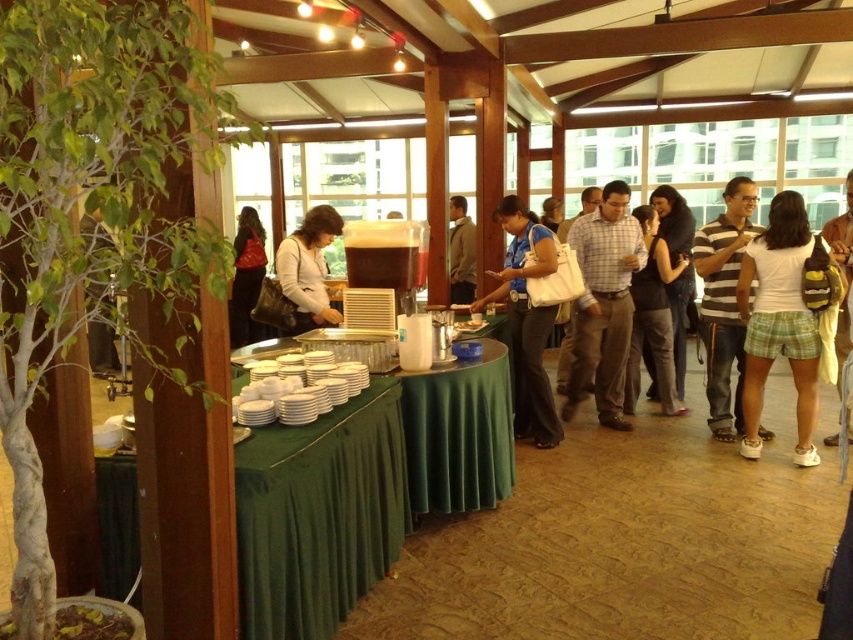
Question: Can you confirm if plaid shirt at center is bigger than striped cotton shirt at center?

Choices:
 (A) no
 (B) yes

Answer: (B)

Question: Can you confirm if white matte plates at center is bigger than dark blue jeans at center?

Choices:
 (A) yes
 (B) no

Answer: (B)

Question: Which of the following is the closest to the observer?

Choices:
 (A) plaid shirt at center
 (B) green fabric table at center
 (C) light brown leather backpack at center right

Answer: (B)

Question: Is striped cotton shirt at center smaller than light brown leather backpack at center right?

Choices:
 (A) no
 (B) yes

Answer: (B)

Question: Which is farther from the white matte shirt at center?

Choices:
 (A) light brown leather backpack at center right
 (B) white cotton shirt at right
 (C) dark gray jacket at center

Answer: (C)

Question: Which of the following is the closest to the observer?

Choices:
 (A) (573, 241)
 (B) (839, 228)
 (C) (756, 266)

Answer: (C)